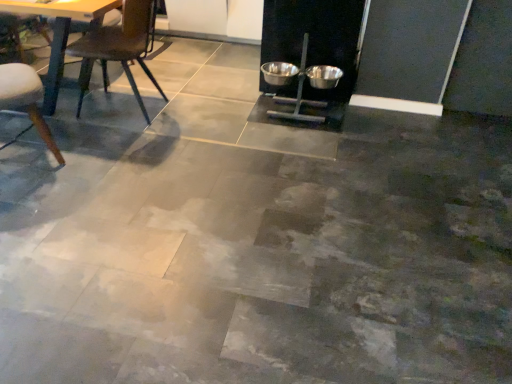
Question: Is metallic bowls at center, placed as the first bowl when sorted from left to right, looking in the opposite direction of wooden chair at left, the first chair positioned from the left?

Choices:
 (A) no
 (B) yes

Answer: (A)

Question: Can you confirm if metallic bowls at center, the second bowl in the right-to-left sequence, is bigger than wooden chair at left, the second chair when ordered from right to left?

Choices:
 (A) yes
 (B) no

Answer: (B)

Question: Would you consider metallic bowls at center, placed as the first bowl when sorted from left to right, to be distant from wooden chair at left, the first chair positioned from the left?

Choices:
 (A) yes
 (B) no

Answer: (A)

Question: Could wooden chair at left, the first chair positioned from the left, be considered to be inside metallic bowls at center, placed as the first bowl when sorted from left to right?

Choices:
 (A) yes
 (B) no

Answer: (B)

Question: Is metallic bowls at center, the second bowl in the right-to-left sequence, smaller than wooden chair at left, the first chair positioned from the left?

Choices:
 (A) no
 (B) yes

Answer: (B)

Question: From the image's perspective, does metallic bowls at center, the second bowl in the right-to-left sequence, appear lower than wooden chair at left, the second chair when ordered from right to left?

Choices:
 (A) no
 (B) yes

Answer: (A)

Question: Does metallic dark brown chair at left, positioned as the 2th chair in left-to-right order, appear on the left side of metallic bowls at center, the second bowl in the right-to-left sequence?

Choices:
 (A) no
 (B) yes

Answer: (B)

Question: Are metallic dark brown chair at left, the first chair positioned from the right, and metallic bowls at center, the second bowl in the right-to-left sequence, beside each other?

Choices:
 (A) yes
 (B) no

Answer: (B)

Question: Is metallic dark brown chair at left, positioned as the 2th chair in left-to-right order, closer to the viewer compared to metallic bowls at center, placed as the first bowl when sorted from left to right?

Choices:
 (A) no
 (B) yes

Answer: (B)

Question: From a real-world perspective, is metallic dark brown chair at left, positioned as the 2th chair in left-to-right order, located beneath metallic bowls at center, placed as the first bowl when sorted from left to right?

Choices:
 (A) no
 (B) yes

Answer: (A)

Question: Does metallic dark brown chair at left, the first chair positioned from the right, have a larger size compared to metallic bowls at center, the second bowl in the right-to-left sequence?

Choices:
 (A) no
 (B) yes

Answer: (B)

Question: Can you confirm if metallic dark brown chair at left, the first chair positioned from the right, is taller than metallic bowls at center, the second bowl in the right-to-left sequence?

Choices:
 (A) no
 (B) yes

Answer: (B)

Question: Is there a large distance between wooden chair at left, the first chair positioned from the left, and metallic dark brown chair at left, positioned as the 2th chair in left-to-right order?

Choices:
 (A) yes
 (B) no

Answer: (B)